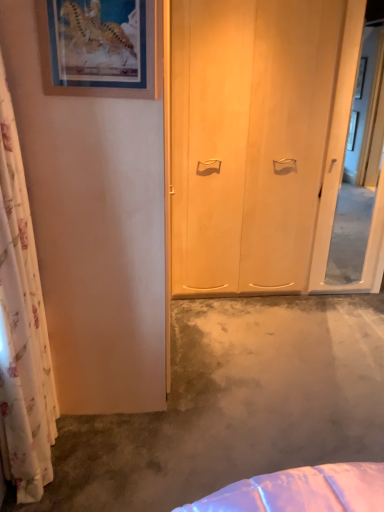
Image resolution: width=384 pixels, height=512 pixels. I want to click on spots to the right of white floral curtain at left, so click(x=98, y=453).